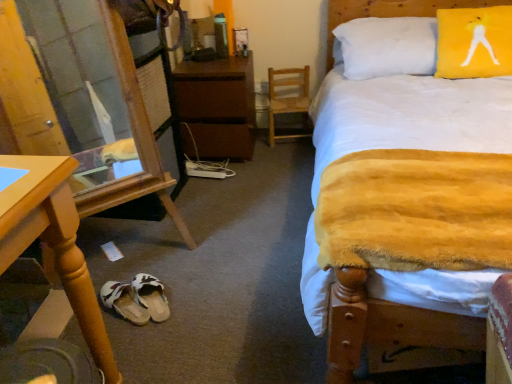
What are the coordinates of `free area below transparent glass door at lower left (from a real-world perspective)` in the screenshot? It's located at (132, 253).